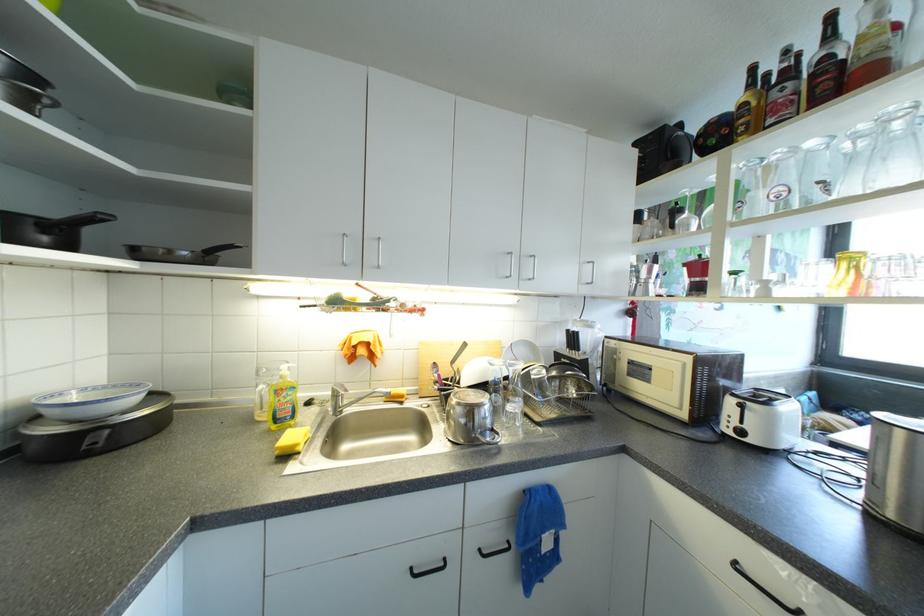
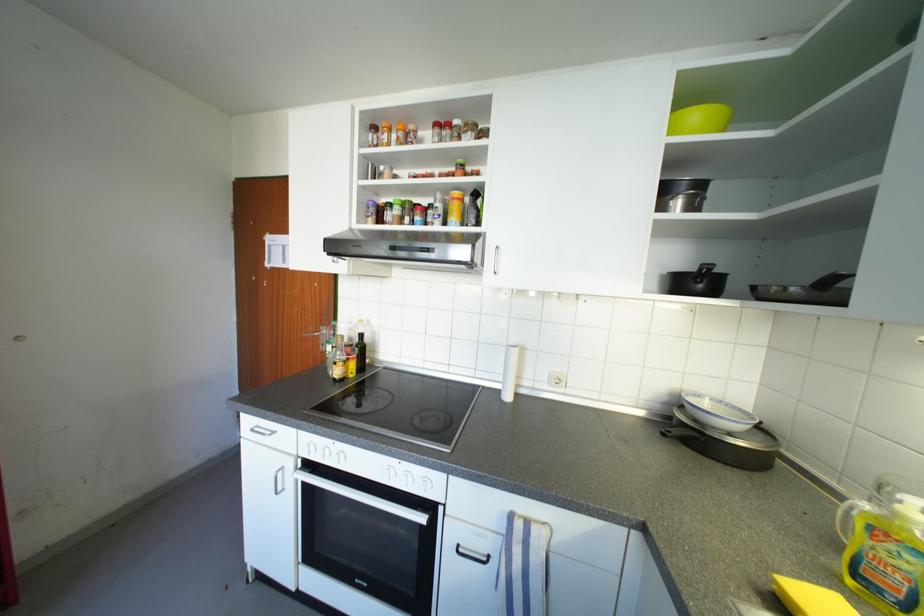
Find the pixel in the second image that matches the point at 298,440 in the first image.

(824, 602)